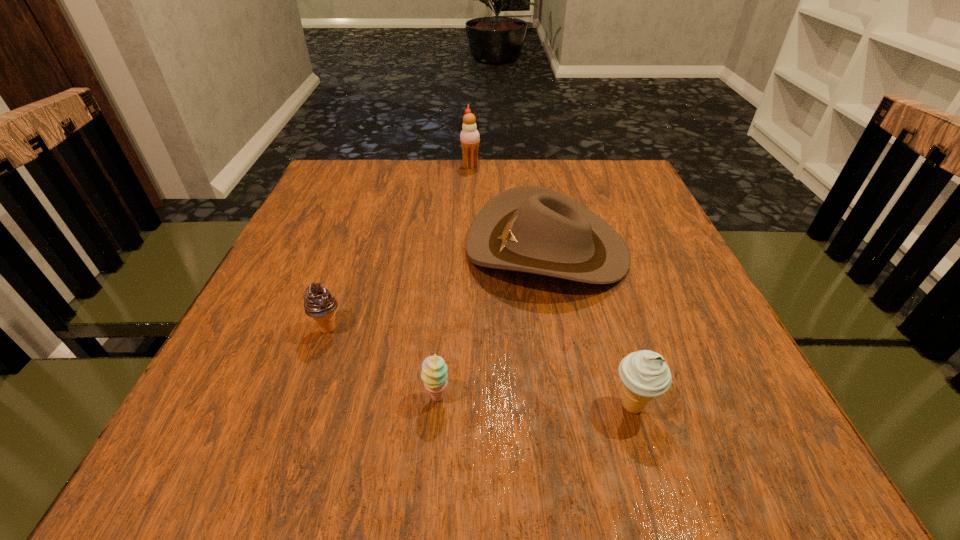
In the image, there is a desktop. Where is `free region at the left edge`? The width and height of the screenshot is (960, 540). free region at the left edge is located at coordinates (270, 321).

Locate an element on the screen. This screenshot has height=540, width=960. free space at the right edge of the desktop is located at coordinates (639, 228).

I want to click on vacant space at the far left corner of the desktop, so click(x=344, y=160).

At what (x,y) coordinates should I click in order to perform the action: click on free location at the near left corner of the desktop. Please return your answer as a coordinate pair (x, y). This screenshot has height=540, width=960. Looking at the image, I should click on (146, 484).

In the image, there is a desktop. Where is `vacant space at the far right corner`? This screenshot has height=540, width=960. vacant space at the far right corner is located at coordinates (635, 183).

I want to click on vacant space at the near right corner of the desktop, so click(745, 460).

I want to click on free space between the third farthest object and the second icecream from right to left, so click(399, 247).

What are the coordinates of `free spot between the second farthest object and the sherbert` in the screenshot? It's located at (492, 323).

This screenshot has height=540, width=960. Identify the location of free space between the nearest icecream and the second nearest icecream. (481, 368).

The width and height of the screenshot is (960, 540). Find the location of `vacant area that lies between the tallest object and the nearest icecream`. vacant area that lies between the tallest object and the nearest icecream is located at coordinates (552, 286).